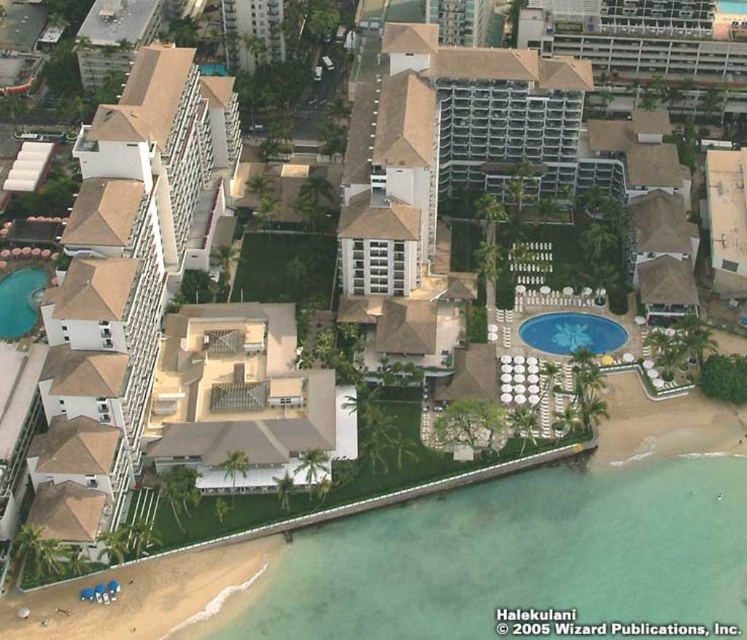
Question: Can you confirm if blue glossy pool at center right is positioned above teal glossy pool at bottom left?

Choices:
 (A) no
 (B) yes

Answer: (A)

Question: Can you confirm if blue glossy pool at center right is thinner than teal glossy pool at bottom left?

Choices:
 (A) no
 (B) yes

Answer: (A)

Question: Is blue glossy pool at center right to the left of teal glossy pool at bottom left from the viewer's perspective?

Choices:
 (A) no
 (B) yes

Answer: (A)

Question: Which object is farther from the camera taking this photo?

Choices:
 (A) blue glossy pool at center right
 (B) teal glossy pool at bottom left

Answer: (A)